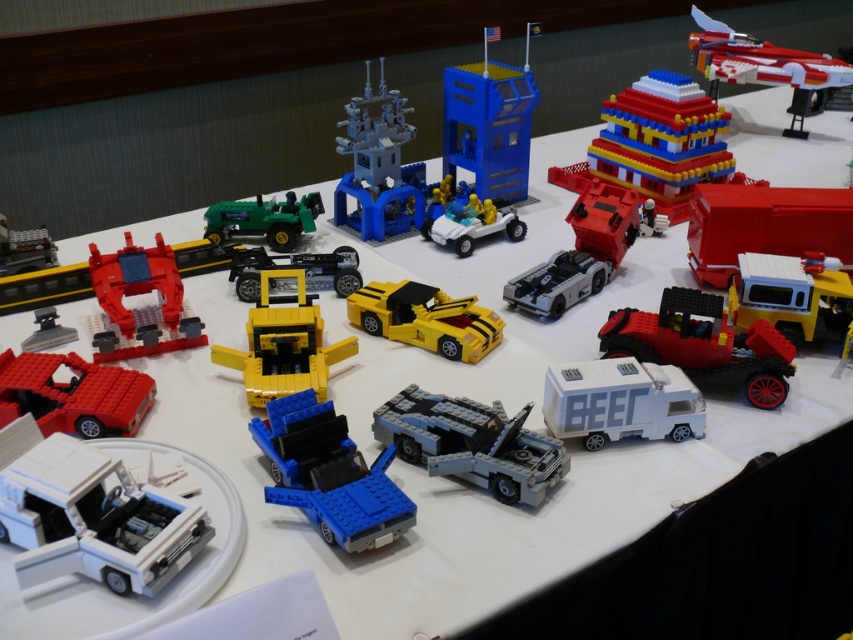
You are a GUI agent. You are given a task and a screenshot of the screen. Output one action in this format:
    pyautogui.click(x=<x>, y=<y>)
    Task: Click on the white matte truck at lower left
    The image size is (853, 640).
    Given the screenshot: What is the action you would take?
    pyautogui.click(x=93, y=520)

Measure the distance between point [39,508] and camera.

They are 82.08 centimeters apart.

The image size is (853, 640). I want to click on white matte truck at lower left, so click(93, 520).

Who is taller, blue plastic truck at center or shiny red and white spaceship at upper right?

With more height is shiny red and white spaceship at upper right.

Where is `blue plastic truck at center`? The height and width of the screenshot is (640, 853). blue plastic truck at center is located at coordinates (329, 474).

Locate an element on the screen. The image size is (853, 640). blue plastic truck at center is located at coordinates (329, 474).

Does brick-like building at upper right have a greater height compared to matte red truck at left?

Yes.

Locate an element on the screen. brick-like building at upper right is located at coordinates (657, 144).